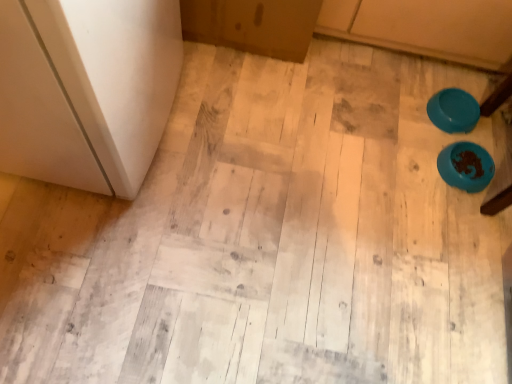
Question: Looking at their shapes, would you say teal glossy bowl at upper right, which is the first bowl from top to bottom, is wider or thinner than blue plastic bowl at lower right, which appears as the second bowl when viewed from the top?

Choices:
 (A) wide
 (B) thin

Answer: (A)

Question: From a real-world perspective, is teal glossy bowl at upper right, which is the first bowl from top to bottom, above or below blue plastic bowl at lower right, the first bowl positioned from the bottom?

Choices:
 (A) below
 (B) above

Answer: (B)

Question: Considering the positions of teal glossy bowl at upper right, which is the first bowl from top to bottom, and blue plastic bowl at lower right, which appears as the second bowl when viewed from the top, in the image, is teal glossy bowl at upper right, which is the first bowl from top to bottom, bigger or smaller than blue plastic bowl at lower right, which appears as the second bowl when viewed from the top,?

Choices:
 (A) big
 (B) small

Answer: (B)

Question: In terms of width, does blue plastic bowl at lower right, the first bowl positioned from the bottom, look wider or thinner when compared to teal glossy bowl at upper right, which is the 2th bowl in bottom-to-top order?

Choices:
 (A) wide
 (B) thin

Answer: (B)

Question: Choose the correct answer: Is blue plastic bowl at lower right, which appears as the second bowl when viewed from the top, inside teal glossy bowl at upper right, which is the first bowl from top to bottom, or outside it?

Choices:
 (A) inside
 (B) outside

Answer: (B)

Question: In terms of size, does blue plastic bowl at lower right, the first bowl positioned from the bottom, appear bigger or smaller than teal glossy bowl at upper right, which is the 2th bowl in bottom-to-top order?

Choices:
 (A) small
 (B) big

Answer: (B)

Question: Considering their positions, is blue plastic bowl at lower right, the first bowl positioned from the bottom, located in front of or behind teal glossy bowl at upper right, which is the first bowl from top to bottom?

Choices:
 (A) behind
 (B) front

Answer: (B)